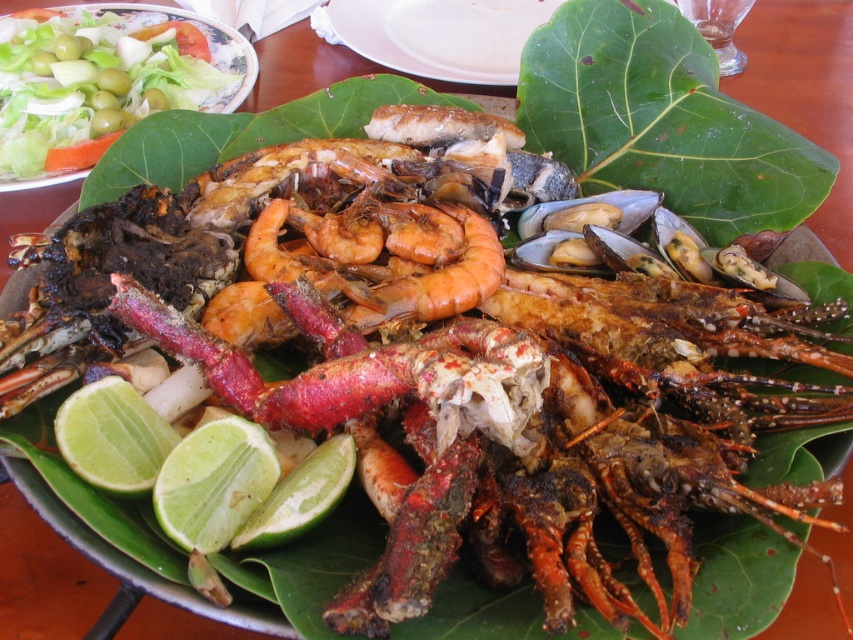
You are a food stylist arranging a seafood platter. You have a green leafy at center and a green leafy platter at center. Which one is closer to you?

The green leafy at center is closer to you because it is in front of the green leafy platter at center.

You are a food photographer setting up a shot of the seafood platter. You want to ensure the green matte lime at lower left is visible in the photo. Since the green leafy at center might block it, is there a way to adjust the camera angle so the lime is still visible?

The green matte lime at lower left is behind the green leafy at center. To ensure visibility, adjust the camera angle to look slightly above or beside the green leafy at center so the lime becomes visible without obstruction.

You are a food critic evaluating this seafood platter. You notice two green leafy items on the plate. Which one is placed lower on the platter, the green leafy at center or the green leafy salad at upper left?

The green leafy at center is placed lower on the platter than the green leafy salad at upper left.